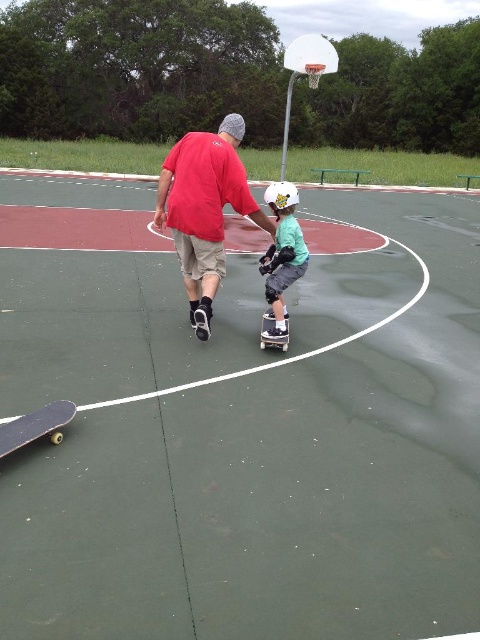
You are designing a new sport court and need to ensure that the green rubber court at center can accommodate a logo of the matte red shirt at center. Can the logo fit on the court without being resized?

The green rubber court at center is wider than the matte red shirt at center, so the logo can fit on the court without resizing.